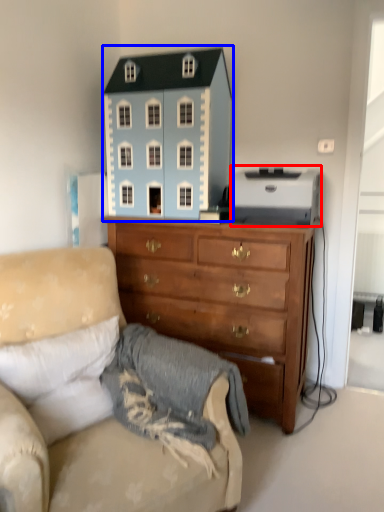
Question: Which point is closer to the camera, toy (highlighted by a red box) or toy (highlighted by a blue box)?

Choices:
 (A) toy
 (B) toy

Answer: (A)